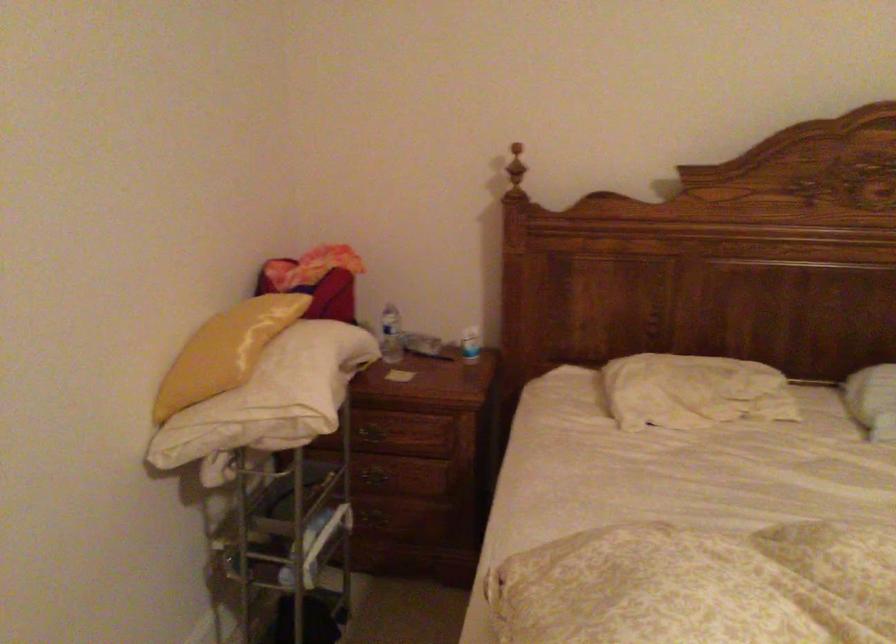
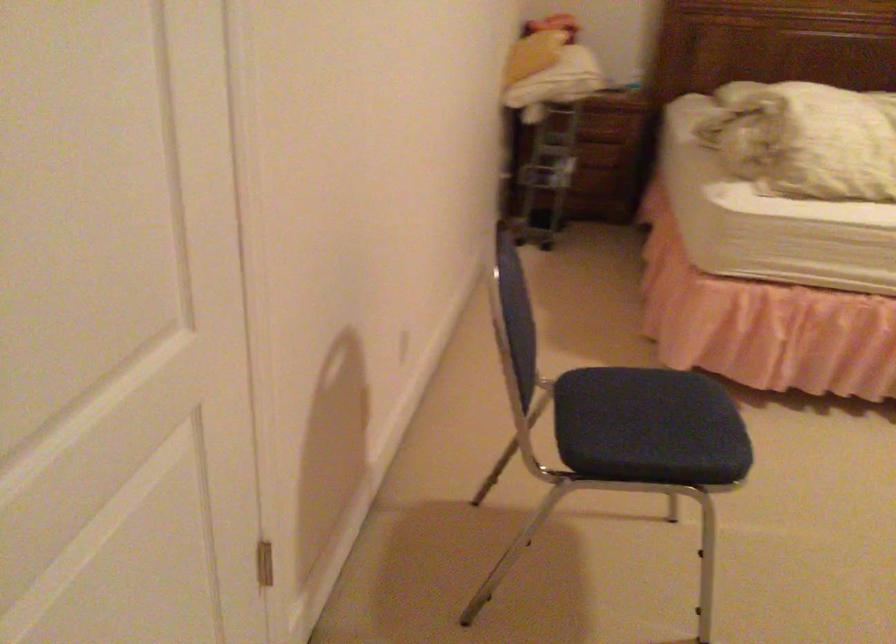
From the picture: The images are taken continuously from a first-person perspective. In which direction are you moving?

The movement direction of the cameraman is left, backward.